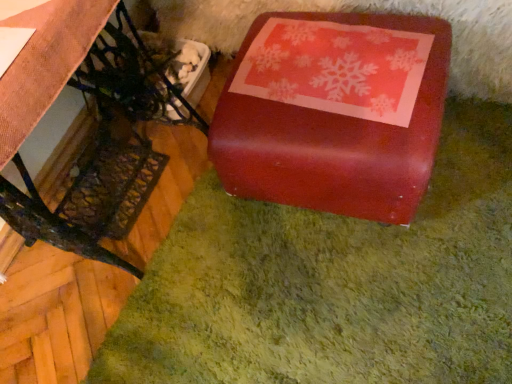
Question: Does shiny red box at right have a lesser height compared to glossy red box at center?

Choices:
 (A) yes
 (B) no

Answer: (B)

Question: Can you confirm if shiny red box at right is bigger than glossy red box at center?

Choices:
 (A) no
 (B) yes

Answer: (B)

Question: From a real-world perspective, is shiny red box at right physically below glossy red box at center?

Choices:
 (A) yes
 (B) no

Answer: (B)

Question: Is the surface of shiny red box at right in direct contact with glossy red box at center?

Choices:
 (A) yes
 (B) no

Answer: (B)

Question: Considering the relative sizes of shiny red box at right and glossy red box at center in the image provided, is shiny red box at right wider than glossy red box at center?

Choices:
 (A) yes
 (B) no

Answer: (B)

Question: From the image's perspective, does shiny red box at right appear lower than glossy red box at center?

Choices:
 (A) yes
 (B) no

Answer: (A)

Question: Is glossy red box at center surrounding shiny red box at right?

Choices:
 (A) no
 (B) yes

Answer: (A)

Question: From a real-world perspective, is glossy red box at center on shiny red box at right?

Choices:
 (A) yes
 (B) no

Answer: (B)

Question: Is glossy red box at center outside of shiny red box at right?

Choices:
 (A) no
 (B) yes

Answer: (B)

Question: Is glossy red box at center shorter than shiny red box at right?

Choices:
 (A) yes
 (B) no

Answer: (A)

Question: Considering the relative sizes of glossy red box at center and shiny red box at right in the image provided, is glossy red box at center smaller than shiny red box at right?

Choices:
 (A) yes
 (B) no

Answer: (A)

Question: Considering the relative positions of glossy red box at center and shiny red box at right in the image provided, is glossy red box at center behind shiny red box at right?

Choices:
 (A) yes
 (B) no

Answer: (A)

Question: In the image, is shiny red box at right positioned in front of or behind glossy red box at center?

Choices:
 (A) behind
 (B) front

Answer: (B)